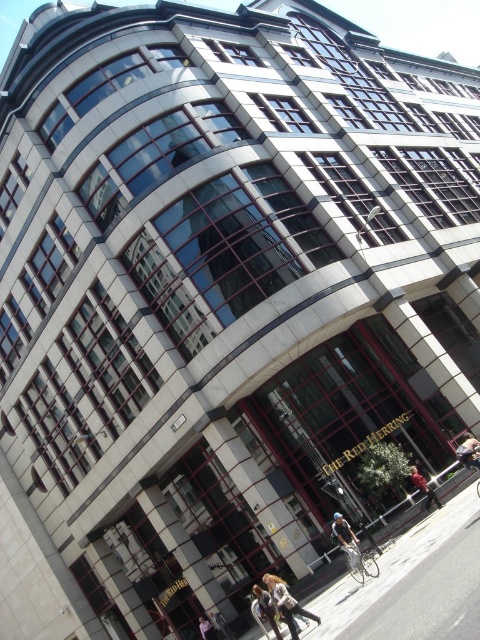
Question: Which of the following is the closest to the observer?

Choices:
 (A) coord(210,624)
 (B) coord(466,444)
 (C) coord(337,529)

Answer: (C)

Question: Is brown leather jacket at center bigger than leather jacket at center?

Choices:
 (A) yes
 (B) no

Answer: (A)

Question: Which object appears farthest from the camera in this image?

Choices:
 (A) leather jacket at lower center
 (B) dark blue jeans at center
 (C) leather jacket at center

Answer: (B)

Question: Does leather jacket at lower center have a greater width compared to light brown leather jacket at lower center?

Choices:
 (A) yes
 (B) no

Answer: (A)

Question: Does denim jacket at lower center have a lesser width compared to leather jacket at lower center?

Choices:
 (A) no
 (B) yes

Answer: (B)

Question: Which object is positioned farthest from the brown leather jacket at center?

Choices:
 (A) leather jacket at lower center
 (B) denim jacket at lower center

Answer: (B)